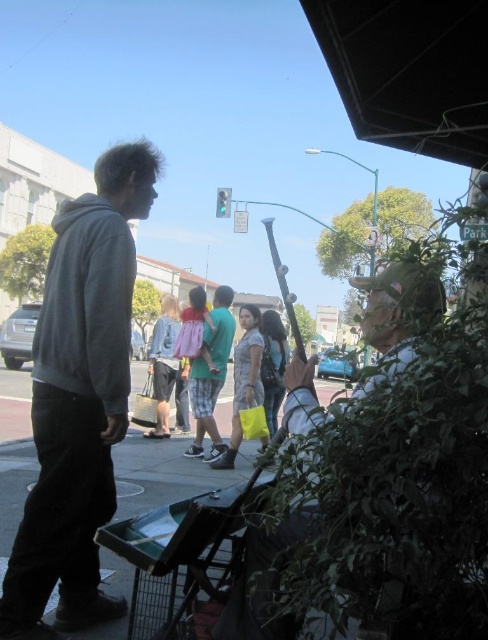
Can you confirm if gray hoodie at left is positioned to the right of leather jacket at center?

No, gray hoodie at left is not to the right of leather jacket at center.

In order to click on gray hoodie at left in this screenshot , I will do `click(79, 400)`.

Between point (40, 452) and point (298, 364), which one is positioned in front?

Positioned in front is point (298, 364).

Identify the location of gray hoodie at left. (79, 400).

Does gray hoodie at left have a greater width compared to metallic silver cart at center?

No, gray hoodie at left is not wider than metallic silver cart at center.

Who is more forward, (x=103, y=486) or (x=168, y=467)?

Point (x=103, y=486)

Measure the distance between point (108, 364) and camera.

The distance of point (108, 364) from camera is 7.32 feet.

What are the coordinates of `gray hoodie at left` in the screenshot? It's located at (79, 400).

Image resolution: width=488 pixels, height=640 pixels. What do you see at coordinates (166, 472) in the screenshot?
I see `metallic silver cart at center` at bounding box center [166, 472].

Is point (128, 468) farther from camera compared to point (269, 572)?

Yes, point (128, 468) is farther from viewer.

Between point (149, 467) and point (445, 307), which one is positioned behind?

The point (149, 467) is behind.

Where is `metallic silver cart at center`? metallic silver cart at center is located at coordinates (166, 472).